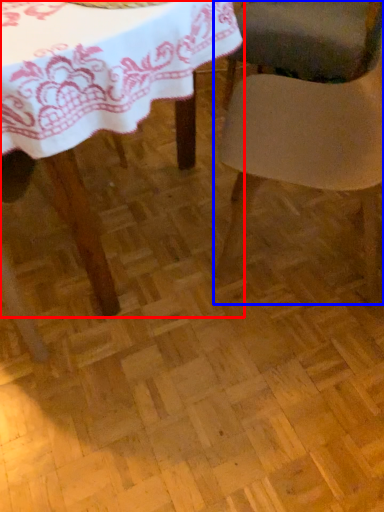
Question: Which point is further to the camera, table (highlighted by a red box) or chair (highlighted by a blue box)?

Choices:
 (A) table
 (B) chair

Answer: (B)